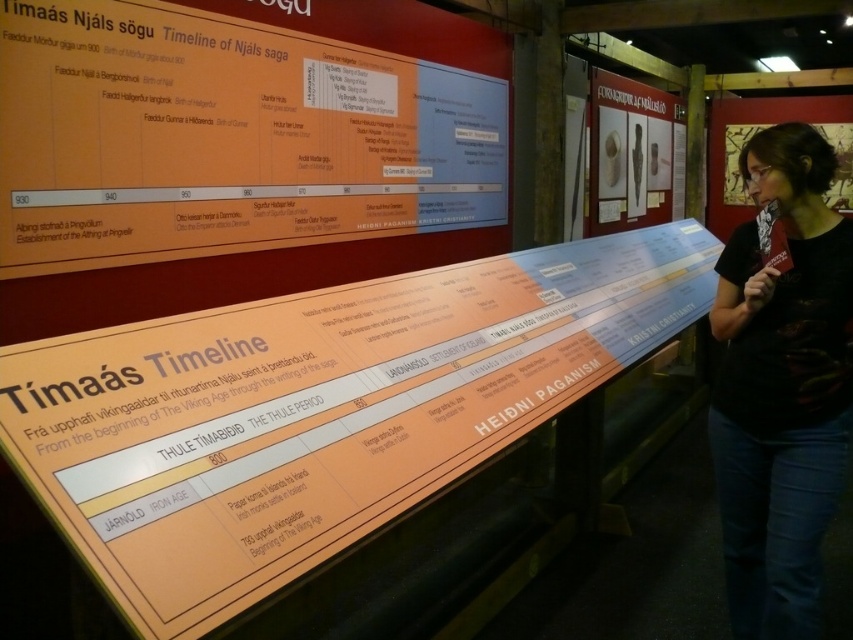
Based on the photo, does matte plastic timeline at center have a smaller size compared to matte black poster at upper right?

No, matte plastic timeline at center is not smaller than matte black poster at upper right.

Can you confirm if matte plastic timeline at center is positioned to the right of matte black poster at upper right?

Incorrect, matte plastic timeline at center is not on the right side of matte black poster at upper right.

Locate an element on the screen. matte plastic timeline at center is located at coordinates (318, 410).

Identify the location of matte plastic timeline at center. The width and height of the screenshot is (853, 640). (318, 410).

Can you confirm if matte orange wall at upper left is wider than black fabric shirt at center?

Correct, the width of matte orange wall at upper left exceeds that of black fabric shirt at center.

Can you confirm if matte orange wall at upper left is bigger than black fabric shirt at center?

Correct, matte orange wall at upper left is larger in size than black fabric shirt at center.

Does point (140, 216) come farther from viewer compared to point (787, 605)?

That is True.

I want to click on matte orange wall at upper left, so click(227, 136).

Is matte white vase at upper right wider than matte black poster at upper right?

Correct, the width of matte white vase at upper right exceeds that of matte black poster at upper right.

Is point (605, 154) less distant than point (751, 132)?

Yes, point (605, 154) is in front of point (751, 132).

Does point (608, 166) come behind point (735, 198)?

No.

The image size is (853, 640). Find the location of `matte white vase at upper right`. matte white vase at upper right is located at coordinates (630, 154).